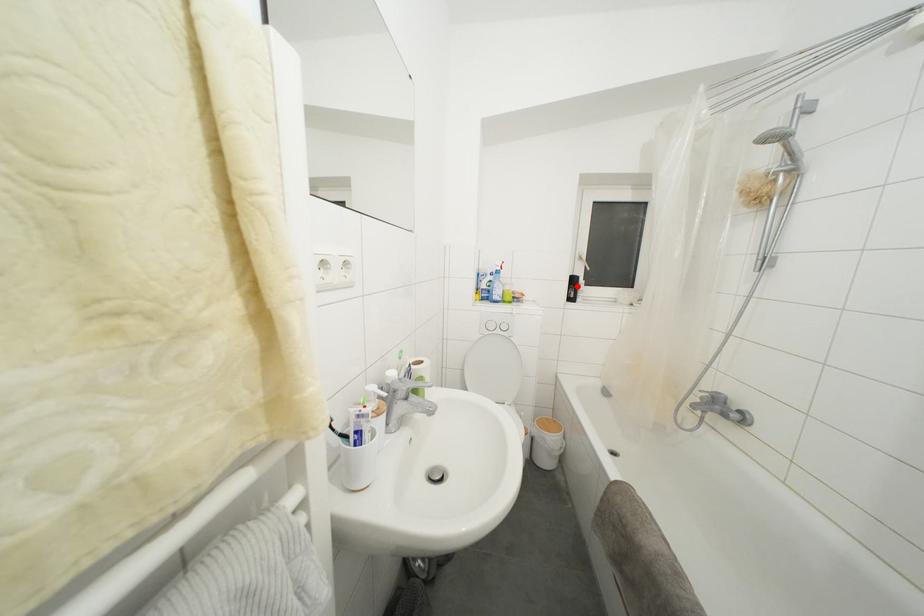
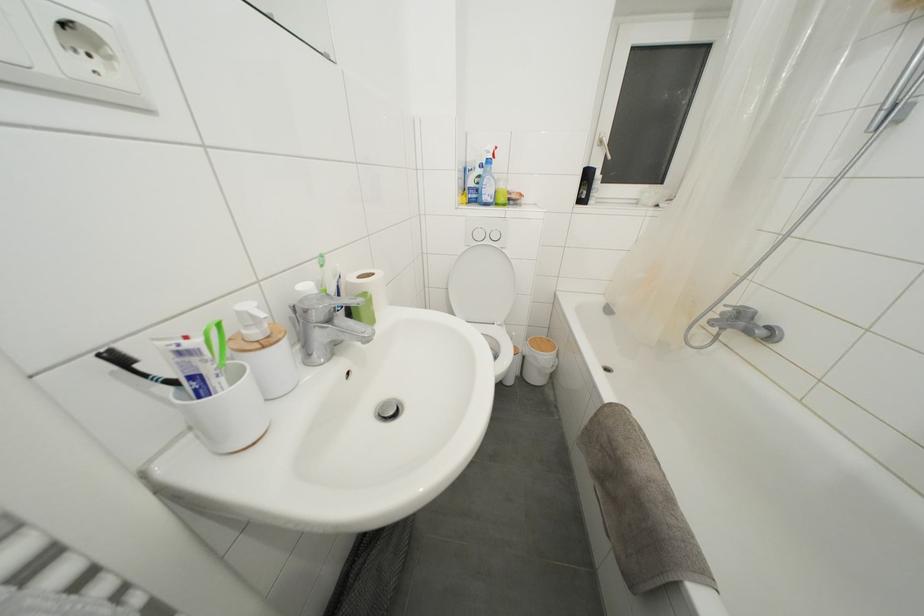
Where in the second image is the point corresponding to the highlighted location from the first image?

(591, 180)